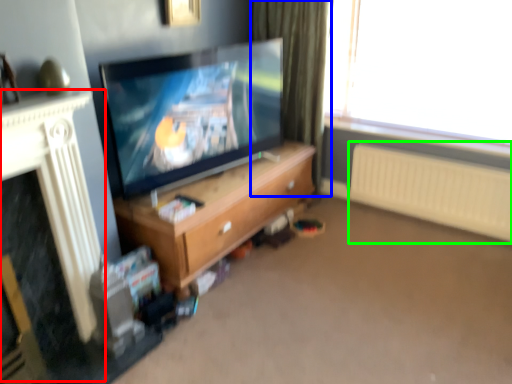
Question: Which object is the closest to the fireplace (highlighted by a red box)? Choose among these: curtain (highlighted by a blue box) or radiator (highlighted by a green box).

Choices:
 (A) curtain
 (B) radiator

Answer: (A)